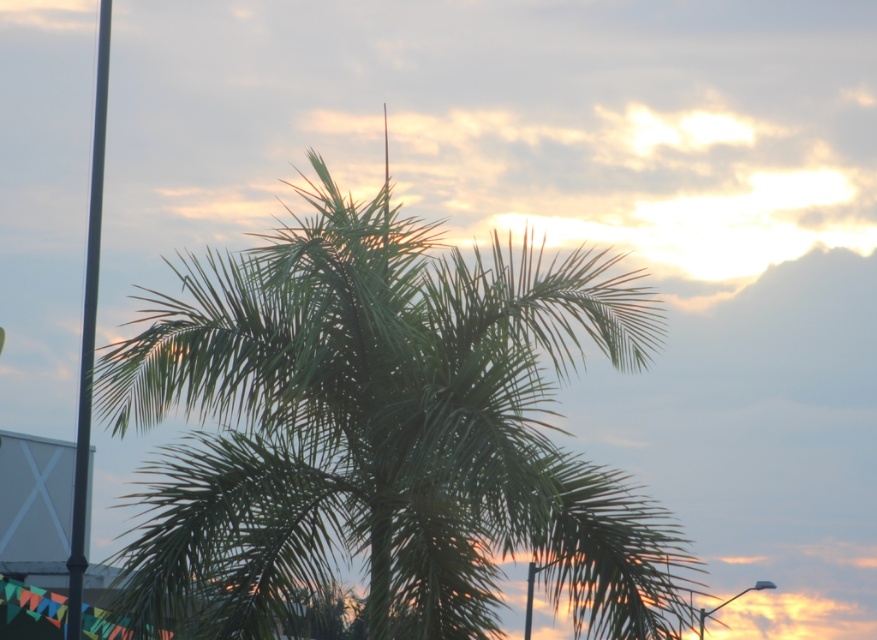
You are an artist planning to paint this scene. You want to ensure the proportions between the green leafy palm tree at center and the metallic pole at left are accurate. Which object should you paint as wider?

The metallic pole at left should be painted as wider since the green leafy palm tree at center has a lesser width compared to it.

You are an artist planning to paint this scene. You want to ensure the green leafy palm tree at center and the metallic pole at left are proportionally accurate. Based on their sizes in the image, which object should you paint smaller?

The green leafy palm tree at center should be painted smaller because it occupies less space than the metallic pole at left according to the description.